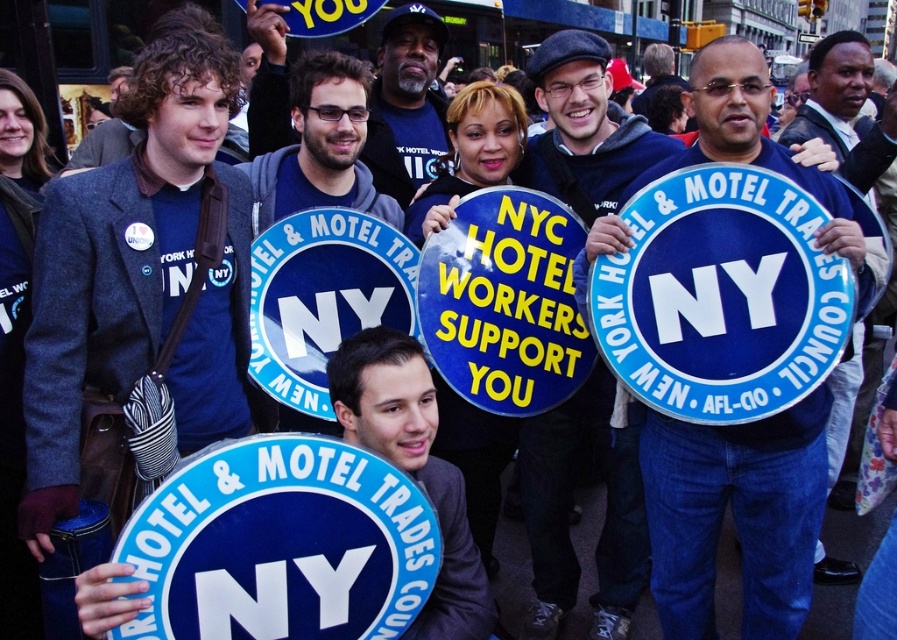
You are a photographer trying to capture a clear shot of both the matte gray blazer at center and the matte blue shirt at center. Since you want to ensure both are visible, which clothing item should you focus on first to account for their sizes?

The matte gray blazer at center is larger than the matte blue shirt at center, so you should focus on the matte gray blazer at center first to ensure its details are captured clearly before adjusting for the smaller matte blue shirt at center.

You are a photographer trying to capture a clear shot of the blue fabric sign at center without any obstructions. Given that the matte gray blazer at center is blocking part of the sign, can you adjust your position to frame the sign properly?

The matte gray blazer at center is in front of the blue fabric sign at center, so moving your position to either side or behind the person wearing the matte gray blazer at center would allow you to capture the blue fabric sign at center without obstruction.